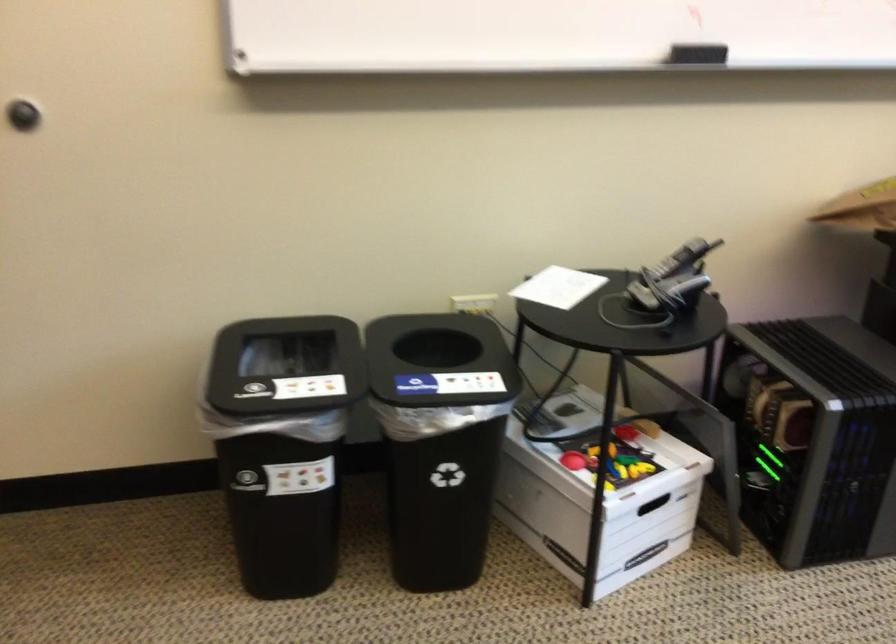
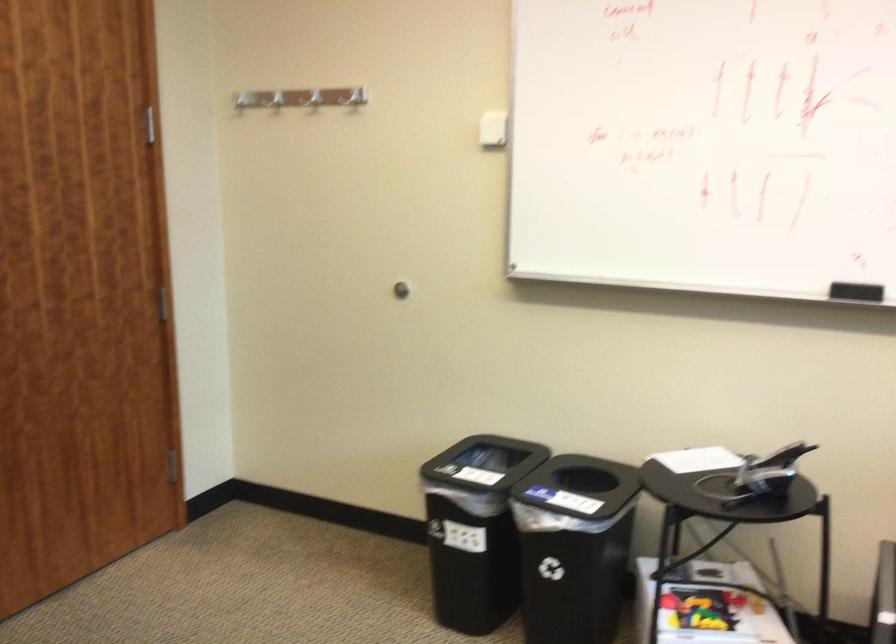
Where in the second image is the point corresponding to (315,462) from the first image?

(475, 529)